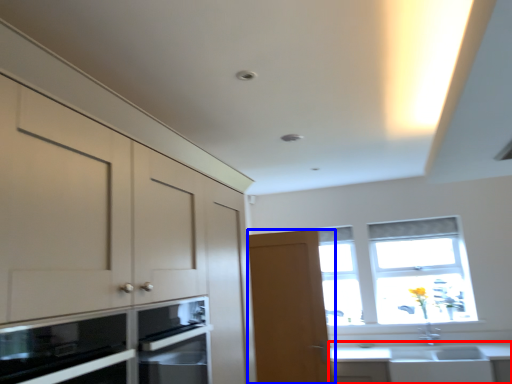
Question: Which object is further to the camera taking this photo, countertop (highlighted by a red box) or door (highlighted by a blue box)?

Choices:
 (A) countertop
 (B) door

Answer: (B)